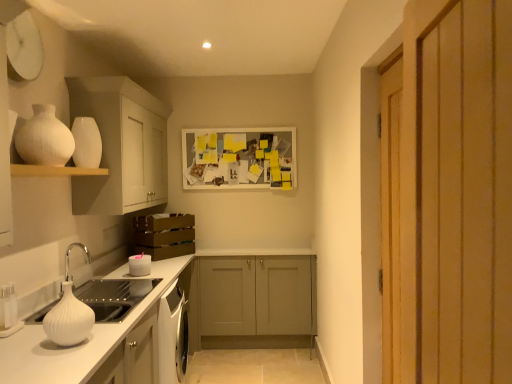
Question: From a real-world perspective, is white matte cabinet at upper left, the second cabinetry viewed from the right, physically above white matte candle at lower left?

Choices:
 (A) yes
 (B) no

Answer: (A)

Question: Considering the relative sizes of white matte cabinet at upper left, the first cabinetry in the top-to-bottom sequence, and white matte candle at lower left in the image provided, is white matte cabinet at upper left, the first cabinetry in the top-to-bottom sequence, wider than white matte candle at lower left?

Choices:
 (A) yes
 (B) no

Answer: (A)

Question: Is white matte cabinet at upper left, which ranks as the 2th cabinetry in back-to-front order, outside white matte candle at lower left?

Choices:
 (A) no
 (B) yes

Answer: (B)

Question: From a real-world perspective, is white matte cabinet at upper left, marked as the first cabinetry in a front-to-back arrangement, positioned under white matte candle at lower left based on gravity?

Choices:
 (A) no
 (B) yes

Answer: (A)

Question: Is white matte cabinet at upper left, placed as the first cabinetry when sorted from left to right, behind white matte candle at lower left?

Choices:
 (A) no
 (B) yes

Answer: (A)

Question: Does white matte cabinet at upper left, the first cabinetry in the top-to-bottom sequence, have a lesser width compared to white matte candle at lower left?

Choices:
 (A) yes
 (B) no

Answer: (B)

Question: From the image's perspective, is white matte cabinet at upper left, positioned as the second cabinetry in bottom-to-top order, located above white glossy vase at upper left?

Choices:
 (A) no
 (B) yes

Answer: (B)

Question: Could you tell me if white matte cabinet at upper left, the second cabinetry viewed from the right, is facing white glossy vase at upper left?

Choices:
 (A) no
 (B) yes

Answer: (A)

Question: From a real-world perspective, is white matte cabinet at upper left, the second cabinetry viewed from the right, on top of white glossy vase at upper left?

Choices:
 (A) no
 (B) yes

Answer: (A)

Question: From the image's perspective, is white matte cabinet at upper left, which ranks as the 2th cabinetry in back-to-front order, beneath white glossy vase at upper left?

Choices:
 (A) no
 (B) yes

Answer: (A)

Question: Is white matte cabinet at upper left, placed as the first cabinetry when sorted from left to right, oriented away from white glossy vase at upper left?

Choices:
 (A) no
 (B) yes

Answer: (A)

Question: Is white matte cabinet at upper left, marked as the first cabinetry in a front-to-back arrangement, placed right next to white glossy vase at upper left?

Choices:
 (A) yes
 (B) no

Answer: (B)

Question: Considering the relative sizes of matte gray cabinet at center, placed as the second cabinetry when sorted from front to back, and white matte candle at lower left in the image provided, is matte gray cabinet at center, placed as the second cabinetry when sorted from front to back, thinner than white matte candle at lower left?

Choices:
 (A) no
 (B) yes

Answer: (A)